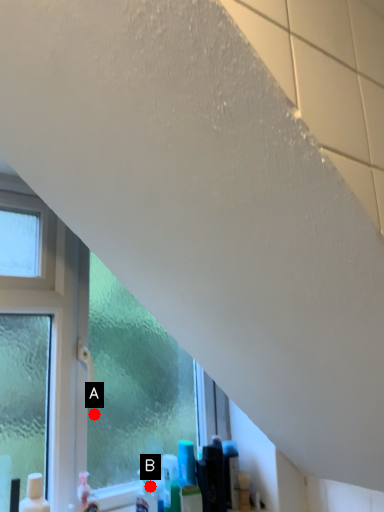
Question: Two points are circled on the image, labeled by A and B beside each circle. Which point is further to the camera?

Choices:
 (A) A is further
 (B) B is further

Answer: (A)